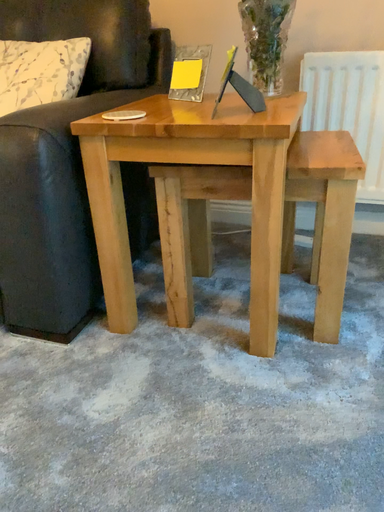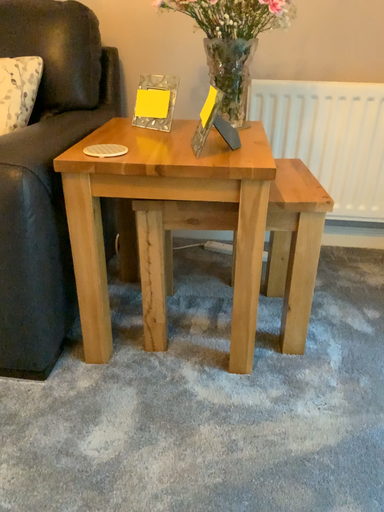
Question: How did the camera likely rotate when shooting the video?

Choices:
 (A) rotated left
 (B) rotated right

Answer: (B)